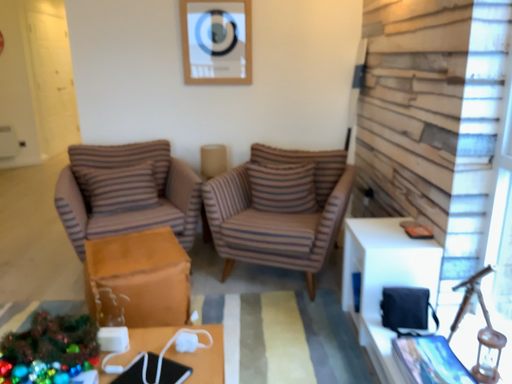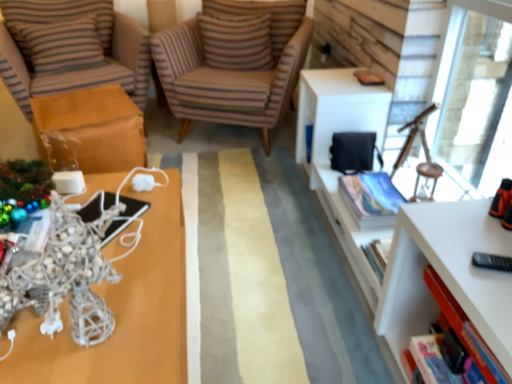
Question: Which way did the camera rotate in the video?

Choices:
 (A) rotated downward
 (B) rotated upward

Answer: (A)